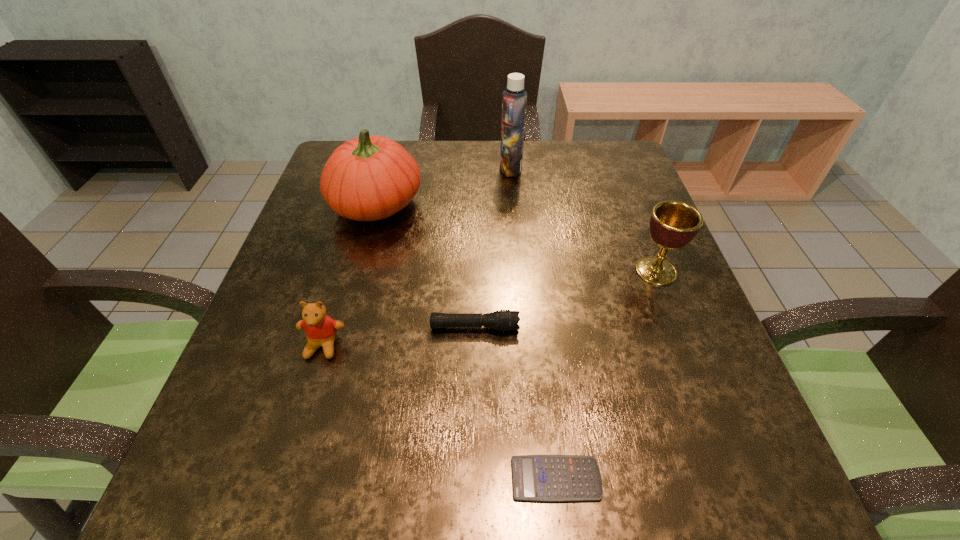
At what (x,y) coordinates should I click in order to perform the action: click on teddy bear that is at the left edge. Please return your answer as a coordinate pair (x, y). Image resolution: width=960 pixels, height=540 pixels. Looking at the image, I should click on pos(320,329).

Locate an element on the screen. Image resolution: width=960 pixels, height=540 pixels. object located in the right edge section of the desktop is located at coordinates (673, 224).

Find the location of a particular element. This screenshot has height=540, width=960. object at the far left corner is located at coordinates (368, 178).

This screenshot has width=960, height=540. I want to click on free space at the far edge of the desktop, so click(x=570, y=178).

Find the location of a particular element. This screenshot has height=540, width=960. vacant space at the near edge of the desktop is located at coordinates (480, 507).

What are the coordinates of `vacant space at the left edge of the desktop` in the screenshot? It's located at (283, 318).

You are a GUI agent. You are given a task and a screenshot of the screen. Output one action in this format:
    pyautogui.click(x=<x>, y=<y>)
    Task: Click on the free region at the right edge of the desktop
    
    Given the screenshot: What is the action you would take?
    pyautogui.click(x=623, y=231)

Image resolution: width=960 pixels, height=540 pixels. What are the coordinates of `blank area at the far right corner` in the screenshot? It's located at 576,141.

Identify the location of empty location between the second shortest object and the rightmost object. This screenshot has width=960, height=540. (565, 299).

The height and width of the screenshot is (540, 960). Identify the location of vacant space that's between the shortest object and the fifth shortest object. (467, 342).